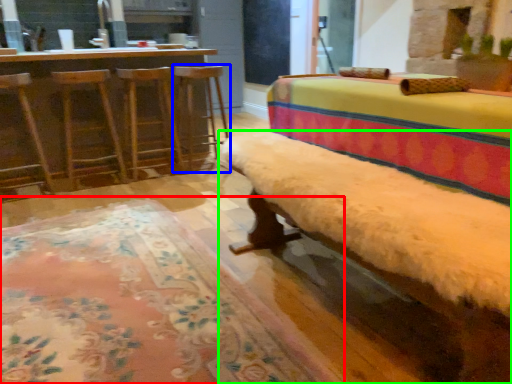
Question: Based on their relative distances, which object is farther from mat (highlighted by a red box)? Choose from bar stool (highlighted by a blue box) and furniture (highlighted by a green box).

Choices:
 (A) bar stool
 (B) furniture

Answer: (A)